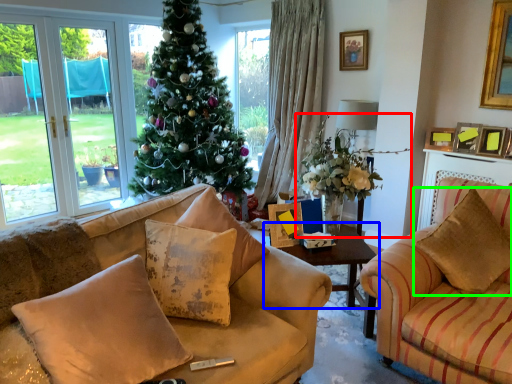
Question: Which object is the farthest from houseplant (highlighted by a red box)? Choose among these: table (highlighted by a blue box) or pillow (highlighted by a green box).

Choices:
 (A) table
 (B) pillow

Answer: (B)